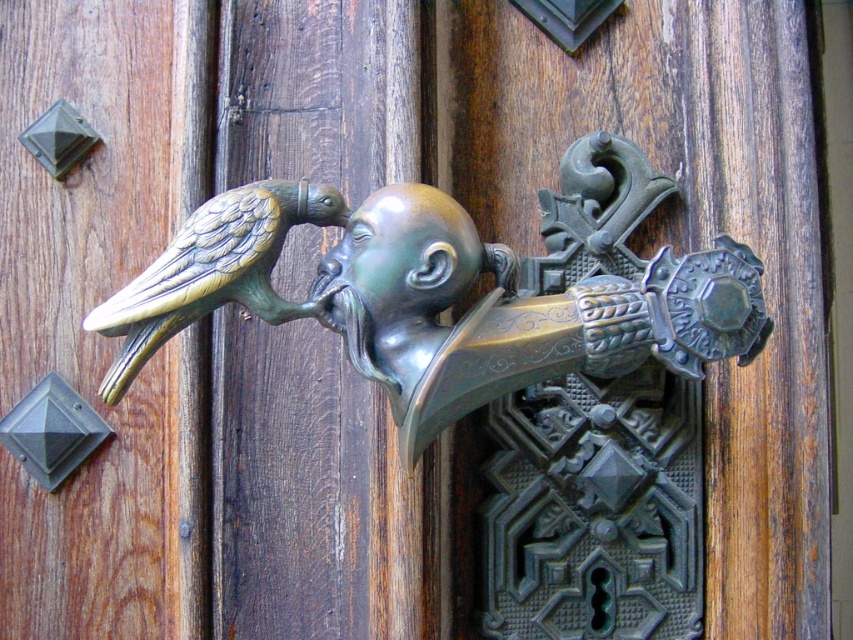
You are standing in front of the door with the decorative knocker. There are two points marked on the door knocker, one at coordinates point (694, 355) and the other at point (320, 220). Which of these two points is closer to you?

Point (694, 355) is closer to you because it is further to the viewer than point (320, 220).